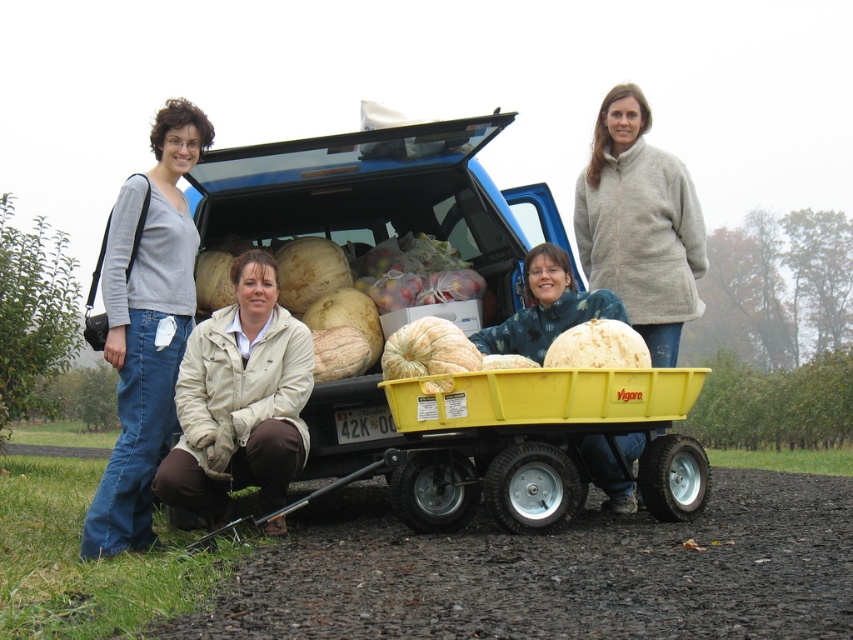
Question: Does matte gray sweater at left appear under beige fabric jacket at lower center?

Choices:
 (A) yes
 (B) no

Answer: (B)

Question: Can you confirm if matte gray sweater at left is smaller than beige fabric jacket at lower center?

Choices:
 (A) no
 (B) yes

Answer: (A)

Question: Does beige fabric jacket at lower center lie behind smooth white pumpkin at center?

Choices:
 (A) no
 (B) yes

Answer: (A)

Question: Among these points, which one is farthest from the camera?

Choices:
 (A) (625, 289)
 (B) (172, 253)

Answer: (A)

Question: Which point is closer to the camera?

Choices:
 (A) beige fabric jacket at lower center
 (B) matte gray sweater at left
 (C) smooth white pumpkin at center

Answer: (B)

Question: Which point is farther to the camera?

Choices:
 (A) pos(236,477)
 (B) pos(618,179)
 (C) pos(112,248)

Answer: (B)